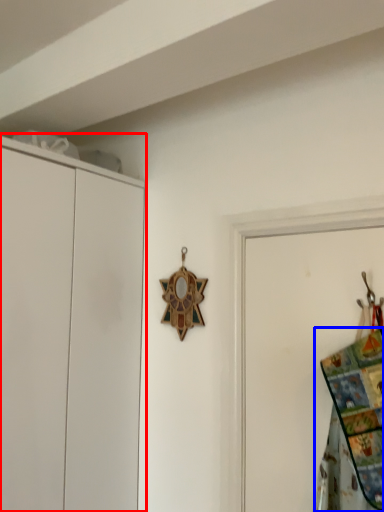
Question: Which object appears farthest to the camera in this image, cupboard (highlighted by a red box) or blanket (highlighted by a blue box)?

Choices:
 (A) cupboard
 (B) blanket

Answer: (A)